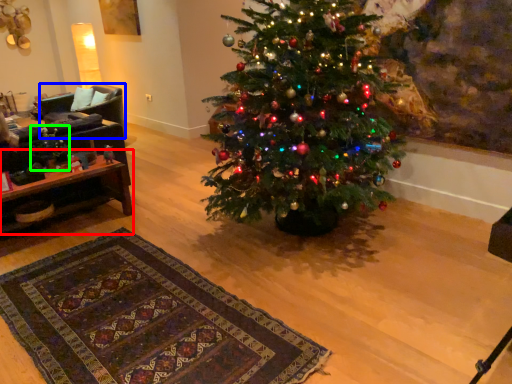
Question: Estimate the real-world distances between objects in this image. Which object is farther from table (highlighted by a red box), armchair (highlighted by a blue box) or christmas decoration (highlighted by a green box)?

Choices:
 (A) armchair
 (B) christmas decoration

Answer: (A)